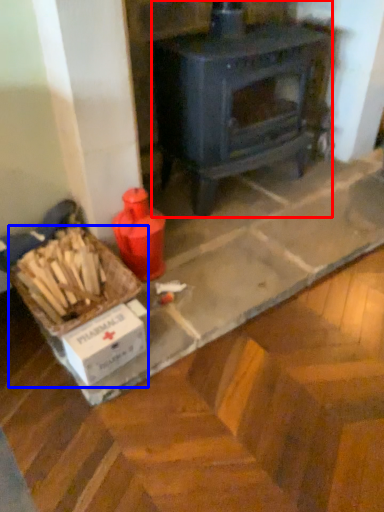
Question: Which object is closer to the camera taking this photo, wood burning stove (highlighted by a red box) or box (highlighted by a blue box)?

Choices:
 (A) wood burning stove
 (B) box

Answer: (B)